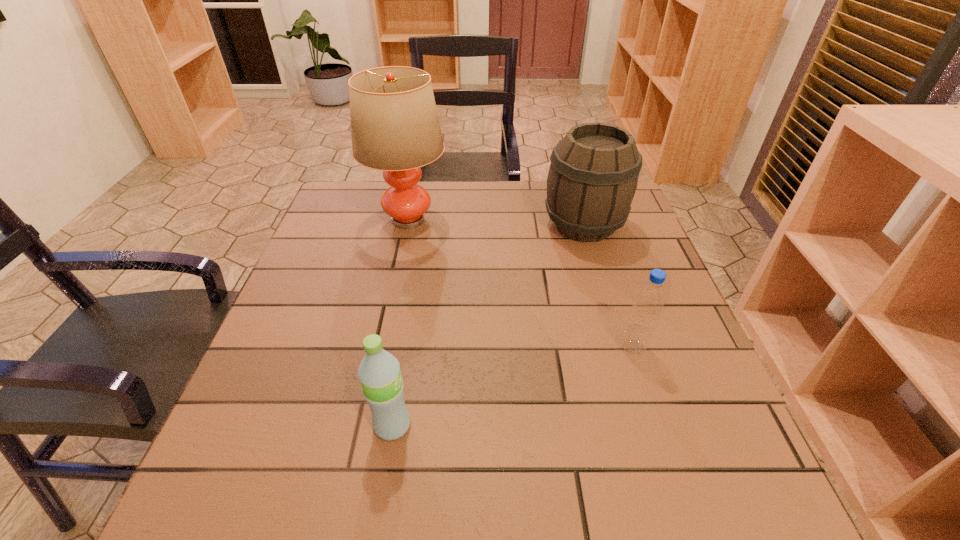
Where is `vacant point located between the wine bucket and the third farthest object`? Image resolution: width=960 pixels, height=540 pixels. vacant point located between the wine bucket and the third farthest object is located at coordinates (609, 286).

Where is `vacant point located between the wine bucket and the farther water bottle`? The image size is (960, 540). vacant point located between the wine bucket and the farther water bottle is located at coordinates (609, 286).

Locate an element on the screen. free space between the farther water bottle and the tallest object is located at coordinates (520, 284).

Choose which object is the second nearest neighbor to the right water bottle. Please provide its 2D coordinates. Your answer should be formatted as a tuple, i.e. [(x, y)], where the tuple contains the x and y coordinates of a point satisfying the conditions above.

[(379, 372)]

I want to click on object that is the closest to the lamp, so click(x=593, y=176).

What are the coordinates of `vacant space that satisfies the following two spatial constraints: 1. on the front side of the tallest object; 2. on the right side of the farther water bottle` in the screenshot? It's located at tap(381, 347).

Find the location of a particular element. This screenshot has height=540, width=960. free space that satisfies the following two spatial constraints: 1. on the back side of the wine bucket; 2. on the left side of the left water bottle is located at coordinates (424, 225).